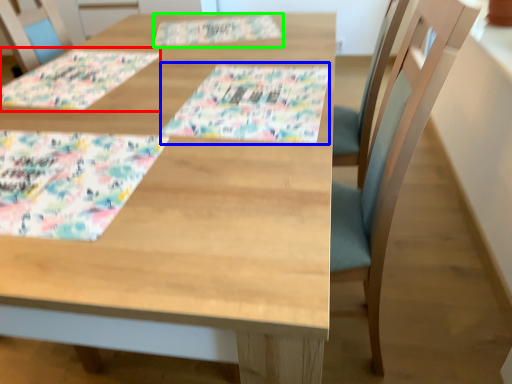
Question: Which object is the closest to the place mat (highlighted by a red box)? Choose among these: tablecloth (highlighted by a blue box) or place mat (highlighted by a green box).

Choices:
 (A) tablecloth
 (B) place mat

Answer: (B)